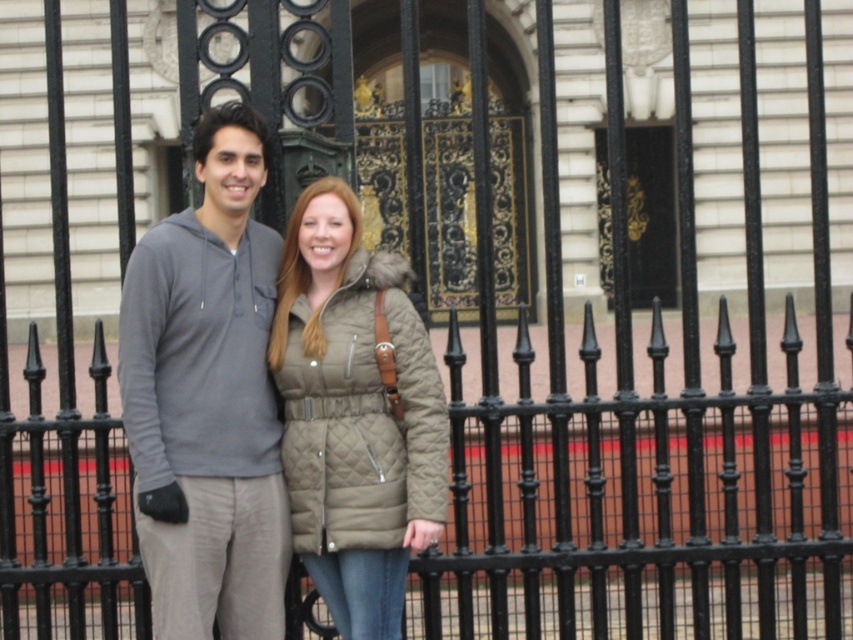
Looking at this image, is gray hoodie at center further to the viewer compared to gold ornate door at center?

No, gray hoodie at center is in front of gold ornate door at center.

Is point (224, 627) closer to camera compared to point (654, 195)?

Yes, point (224, 627) is in front of point (654, 195).

This screenshot has width=853, height=640. Describe the element at coordinates (207, 397) in the screenshot. I see `gray hoodie at center` at that location.

Where is `gray hoodie at center`? The image size is (853, 640). gray hoodie at center is located at coordinates (207, 397).

Is quilted olive coat at center closer to camera compared to gold ornate door at center?

Yes, it is.

Which is more to the right, quilted olive coat at center or gold ornate door at center?

Positioned to the right is gold ornate door at center.

This screenshot has height=640, width=853. I want to click on quilted olive coat at center, so click(355, 413).

Measure the distance between gray hoodie at center and quilted olive coat at center.

2.58 meters

Who is lower down, gray hoodie at center or quilted olive coat at center?

quilted olive coat at center is lower down.

Who is more forward, (210, 540) or (389, 413)?

Point (210, 540) is more forward.

I want to click on gray hoodie at center, so click(207, 397).